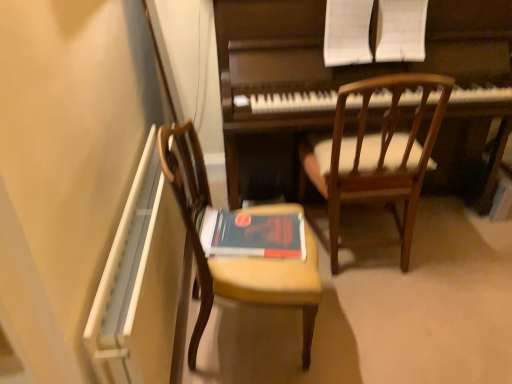
Question: Considering the relative sizes of wooden chair at left, marked as the 2th chair in a right-to-left arrangement, and dark wood piano at center in the image provided, is wooden chair at left, marked as the 2th chair in a right-to-left arrangement, wider than dark wood piano at center?

Choices:
 (A) no
 (B) yes

Answer: (A)

Question: Is the depth of wooden chair at left, marked as the 2th chair in a right-to-left arrangement, greater than that of dark wood piano at center?

Choices:
 (A) yes
 (B) no

Answer: (B)

Question: Can you confirm if wooden chair at left, marked as the 2th chair in a right-to-left arrangement, is thinner than dark wood piano at center?

Choices:
 (A) yes
 (B) no

Answer: (A)

Question: Is wooden chair at left, positioned as the first chair in left-to-right order, oriented towards dark wood piano at center?

Choices:
 (A) yes
 (B) no

Answer: (B)

Question: Is wooden chair at left, marked as the 2th chair in a right-to-left arrangement, to the left of dark wood piano at center from the viewer's perspective?

Choices:
 (A) yes
 (B) no

Answer: (A)

Question: From the image's perspective, does wooden chair at left, marked as the 2th chair in a right-to-left arrangement, appear higher than dark wood piano at center?

Choices:
 (A) yes
 (B) no

Answer: (B)

Question: Considering the relative sizes of wooden chair at upper right, the second chair from the left, and hardcover book at center in the image provided, is wooden chair at upper right, the second chair from the left, bigger than hardcover book at center?

Choices:
 (A) yes
 (B) no

Answer: (A)

Question: Is wooden chair at upper right, the 1th chair from the right, shorter than hardcover book at center?

Choices:
 (A) no
 (B) yes

Answer: (A)

Question: Is wooden chair at upper right, the 1th chair from the right, further to the viewer compared to hardcover book at center?

Choices:
 (A) no
 (B) yes

Answer: (B)

Question: Can you confirm if wooden chair at upper right, the 1th chair from the right, is thinner than hardcover book at center?

Choices:
 (A) no
 (B) yes

Answer: (A)

Question: Is wooden chair at upper right, the 1th chair from the right, next to hardcover book at center and touching it?

Choices:
 (A) no
 (B) yes

Answer: (A)

Question: Does wooden chair at upper right, the 1th chair from the right, have a greater height compared to hardcover book at center?

Choices:
 (A) yes
 (B) no

Answer: (A)

Question: Is dark wood piano at center oriented towards wooden chair at left, positioned as the first chair in left-to-right order?

Choices:
 (A) no
 (B) yes

Answer: (B)